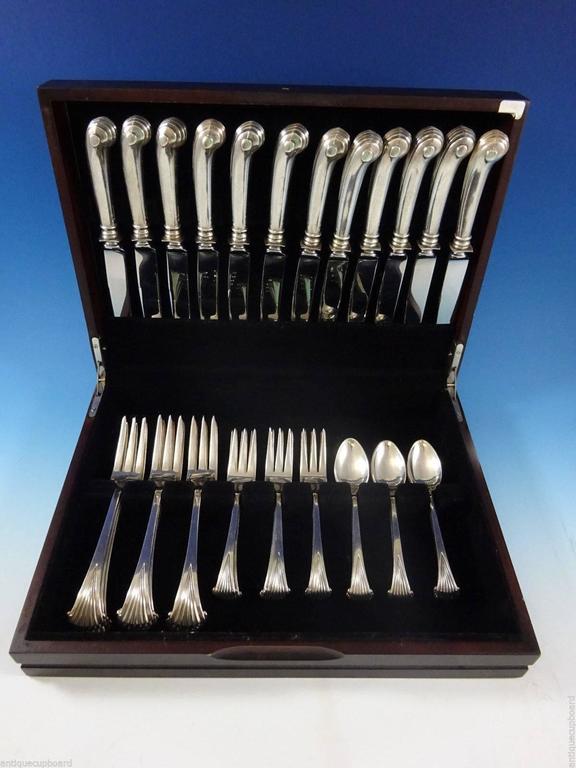
The width and height of the screenshot is (576, 768). I want to click on forks, so click(x=103, y=535), click(x=147, y=550), click(x=190, y=550), click(x=232, y=541), click(x=276, y=538), click(x=320, y=545).